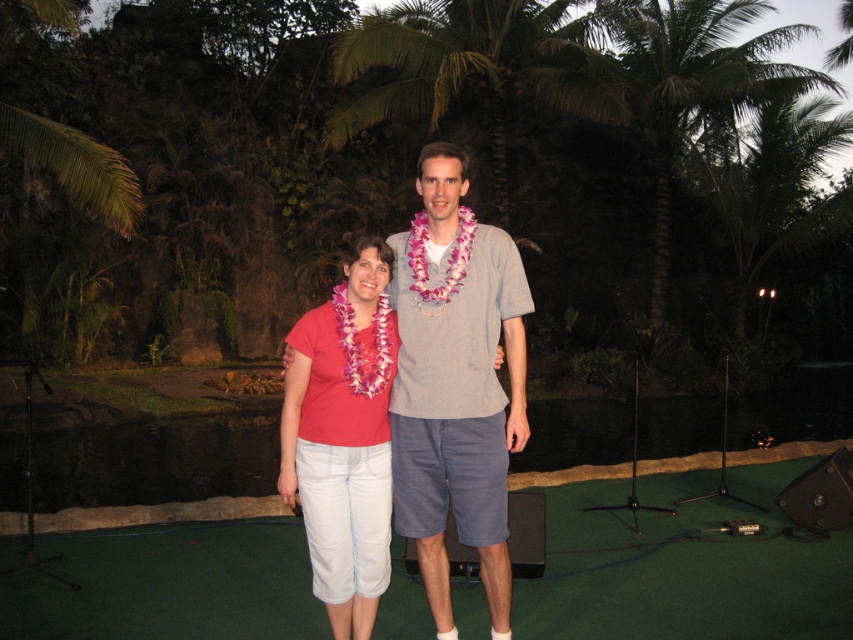
You are standing in the tropical evening scene with two people. There are two points marked in the image. The first point is at coordinates point (784, 566) and the second point is at point (492, 410). Which point is closer to you?

Point (784, 566) is further to the camera than point (492, 410), so the second point is closer to you.

You are planning to take a photo of the two people in the tropical evening scene. The photographer wants to ensure that the person wearing the gray cotton shirt at center is visible above the person in the matte pink shirt at center. Is this possible based on their current positions?

Yes, the gray cotton shirt at center is already positioned above the matte pink shirt at center in the image, so the photographer can capture this arrangement as it is.